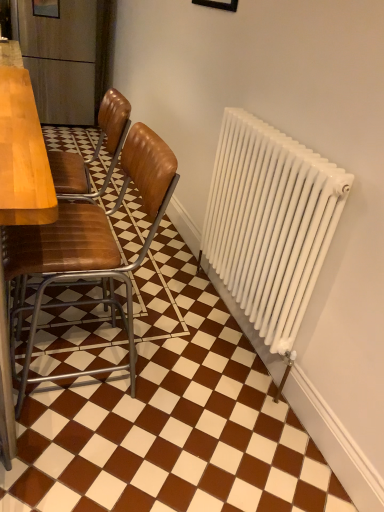
From the picture: Measure the distance between point (73, 305) and camera.

Point (73, 305) and camera are 2.04 meters apart from each other.

Describe the element at coordinates (93, 241) in the screenshot. I see `brown leather chair at left` at that location.

Locate an element on the screen. The height and width of the screenshot is (512, 384). brown leather chair at left is located at coordinates (93, 241).

You are a GUI agent. You are given a task and a screenshot of the screen. Output one action in this format:
    pyautogui.click(x=<x>, y=<y>)
    Task: Click on the brown leather chair at left
    The width and height of the screenshot is (384, 512).
    Given the screenshot: What is the action you would take?
    pyautogui.click(x=93, y=241)